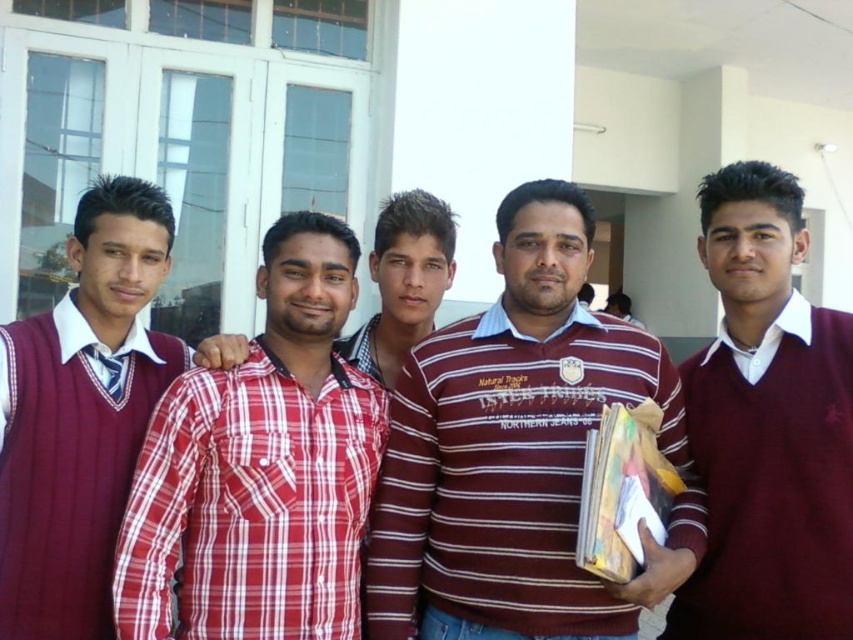
In the image, there are five people standing in front of a building. The first person on the far left is wearing a maroon sweater vest over a collared shirt with a tie. Next to him is someone in a red and white checkered shirt. The third person from the left has a maroon and white striped polo shirt. The fourth person is holding a stack of books and papers and also wears a maroon sweater vest over a collared shirt. Now, there is a point located at coordinates (260, 467). Which person is this point on?

The point at (260, 467) is on the red plaid shirt at center.

Based on the scene description, which of the two individuals is taller? The maroon ribbed sweater at left or the plaid cotton shirt at center?

The maroon ribbed sweater at left is much taller than the plaid cotton shirt at center.